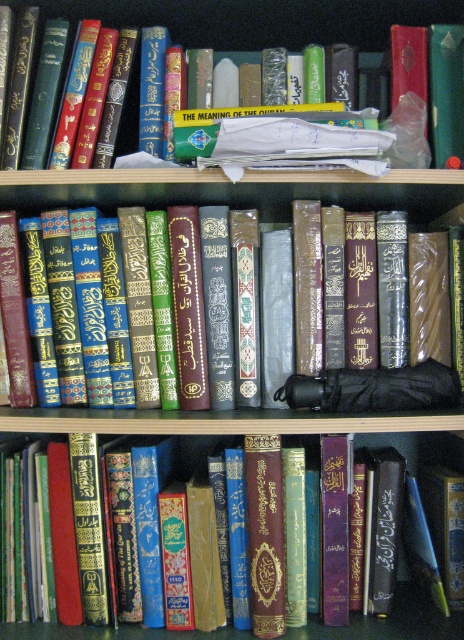
You need to place a bookmark that is 15 cm long. Which book between the green leather book at center and the gold embossed book at center can accommodate it without folding?

The green leather book at center has a larger width than the gold embossed book at center. Since the bookmark is 15 cm long, it can fit into the green leather book at center as it has more space due to its greater width.

You are standing in front of the bookshelf and want to locate two specific points marked on the image. The first point is at coordinate point(414, 636) and the second is at point(412, 362). Which point is closer to you?

Point(414, 636) is in front of point(412, 362), so it is closer to you.

Looking at this image, you are standing in front of the bookshelf and want to place a new book between the two points marked as point (x=181, y=28) and point (x=421, y=236). Can you determine which point is closer to you?

Point (x=181, y=28) is behind point (x=421, y=236), so the closer point to you is point (x=421, y=236).